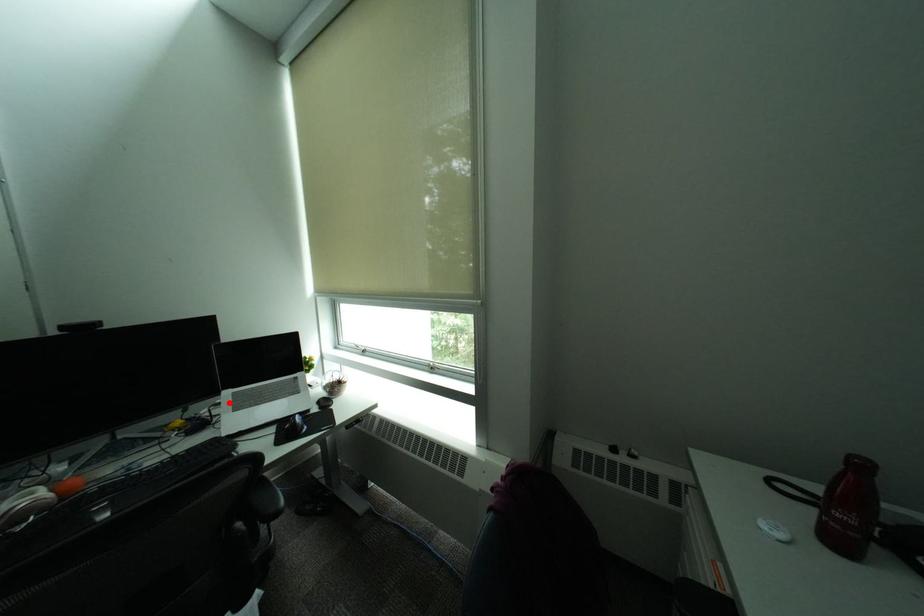
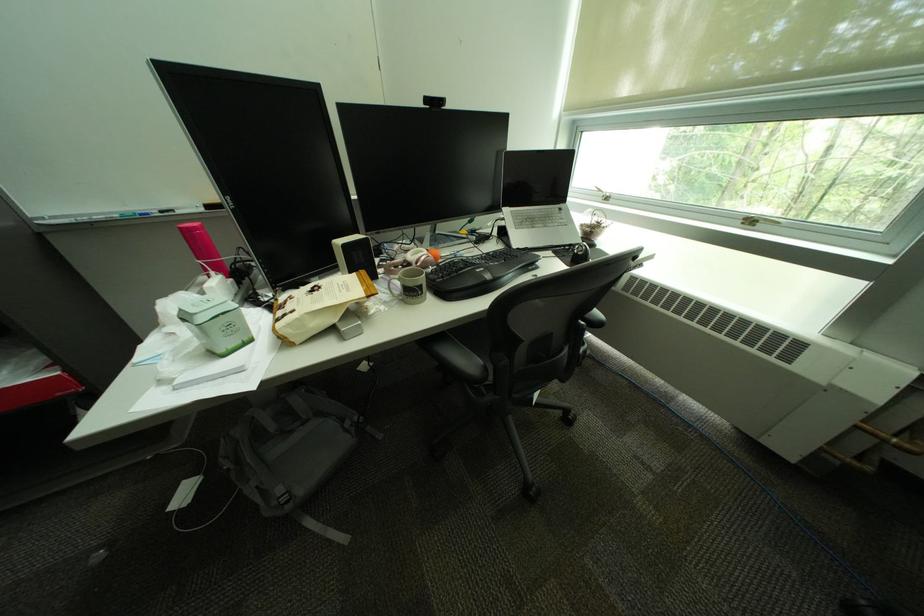
Question: I am providing you with two images of the same scene from different viewpoints. Given a red point in image1, look at the same physical point in image2. Is it:

Choices:
 (A) Closer to the viewpoint
 (B) Farther from the viewpoint

Answer: (A)